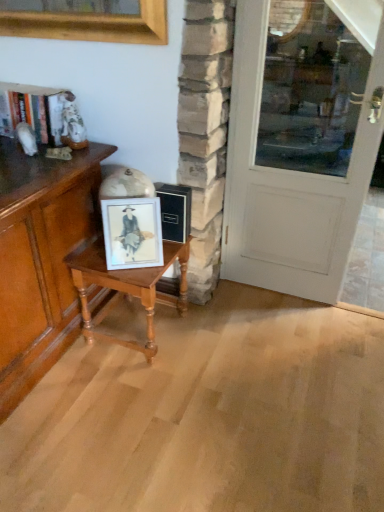
Question: Considering the relative sizes of matte white frame at center and white painted wood door at right in the image provided, is matte white frame at center thinner than white painted wood door at right?

Choices:
 (A) yes
 (B) no

Answer: (A)

Question: From a real-world perspective, is matte white frame at center over white painted wood door at right?

Choices:
 (A) yes
 (B) no

Answer: (B)

Question: Does matte white frame at center have a greater width compared to white painted wood door at right?

Choices:
 (A) no
 (B) yes

Answer: (A)

Question: Is matte white frame at center to the left of white painted wood door at right from the viewer's perspective?

Choices:
 (A) yes
 (B) no

Answer: (A)

Question: Is matte white frame at center with white painted wood door at right?

Choices:
 (A) yes
 (B) no

Answer: (B)

Question: Is wooden table at center taller or shorter than matte wood cabinet at left?

Choices:
 (A) short
 (B) tall

Answer: (A)

Question: Considering the positions of wooden table at center and matte wood cabinet at left in the image, is wooden table at center wider or thinner than matte wood cabinet at left?

Choices:
 (A) thin
 (B) wide

Answer: (A)

Question: Is point (76, 264) positioned closer to the camera than point (66, 291)?

Choices:
 (A) closer
 (B) farther

Answer: (A)

Question: Based on their positions, is wooden table at center located to the left or right of matte wood cabinet at left?

Choices:
 (A) right
 (B) left

Answer: (A)

Question: Do you think white painted wood door at right is within matte wood cabinet at left, or outside of it?

Choices:
 (A) inside
 (B) outside

Answer: (B)

Question: Considering the positions of white painted wood door at right and matte wood cabinet at left in the image, is white painted wood door at right wider or thinner than matte wood cabinet at left?

Choices:
 (A) thin
 (B) wide

Answer: (A)

Question: Is point (284, 106) positioned closer to the camera than point (36, 242)?

Choices:
 (A) farther
 (B) closer

Answer: (A)

Question: Based on their positions, is white painted wood door at right located to the left or right of matte wood cabinet at left?

Choices:
 (A) left
 (B) right

Answer: (B)

Question: From the image's perspective, is matte wood cabinet at left above or below white painted wood door at right?

Choices:
 (A) below
 (B) above

Answer: (A)

Question: From a real-world perspective, relative to white painted wood door at right, is matte wood cabinet at left vertically above or below?

Choices:
 (A) above
 (B) below

Answer: (B)